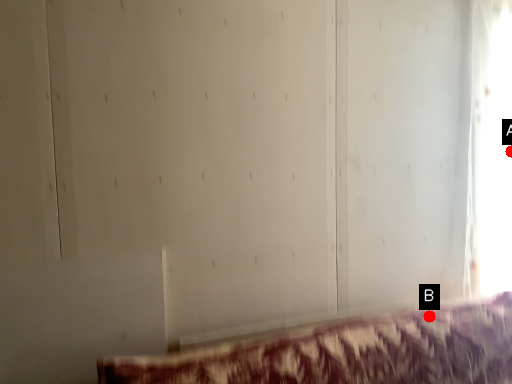
Question: Two points are circled on the image, labeled by A and B beside each circle. Which point is farther to the camera?

Choices:
 (A) A is further
 (B) B is further

Answer: (A)